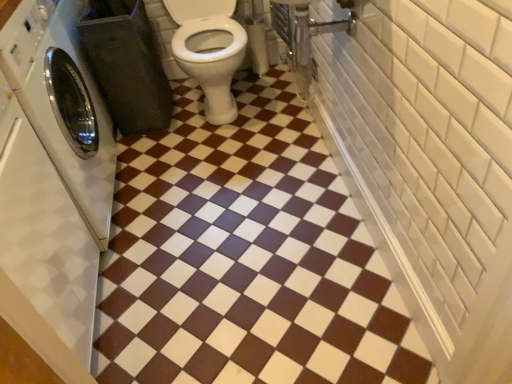
Image resolution: width=512 pixels, height=384 pixels. What do you see at coordinates (245, 257) in the screenshot?
I see `brown glossy tile at center` at bounding box center [245, 257].

This screenshot has width=512, height=384. Identify the location of brown glossy tile at center. coord(245,257).

Describe the element at coordinates (63, 104) in the screenshot. I see `white glossy washing machine at left` at that location.

Measure the distance between point (70, 140) and camera.

1.42 meters.

Locate an element on the screen. white glossy washing machine at left is located at coordinates (63, 104).

Image resolution: width=512 pixels, height=384 pixels. Find the location of `brown glossy tile at center`. brown glossy tile at center is located at coordinates (245, 257).

Considering the positions of objects white glossy washing machine at left and brown glossy tile at center in the image provided, who is more to the right, white glossy washing machine at left or brown glossy tile at center?

Positioned to the right is brown glossy tile at center.

Between white glossy washing machine at left and brown glossy tile at center, which one is positioned behind?

brown glossy tile at center is further from the camera.

Does point (19, 76) appear closer or farther from the camera than point (269, 266)?

Point (19, 76) is positioned closer to the camera compared to point (269, 266).

From the image's perspective, which one is positioned higher, white glossy washing machine at left or brown glossy tile at center?

white glossy washing machine at left appears higher in the image.

From a real-world perspective, which is physically below, white glossy washing machine at left or brown glossy tile at center?

brown glossy tile at center, from a real-world perspective.

Looking at this image, can you confirm if white glossy washing machine at left is wider than brown glossy tile at center?

No.

Can you confirm if white glossy washing machine at left is taller than brown glossy tile at center?

Correct, white glossy washing machine at left is much taller as brown glossy tile at center.

Between white glossy washing machine at left and brown glossy tile at center, which one has larger size?

white glossy washing machine at left.

Does white glossy washing machine at left contain brown glossy tile at center?

Actually, brown glossy tile at center is outside white glossy washing machine at left.

Are white glossy washing machine at left and brown glossy tile at center making contact?

No, white glossy washing machine at left is not next to brown glossy tile at center.

Is white glossy washing machine at left oriented away from brown glossy tile at center?

No, white glossy washing machine at left is not facing away from brown glossy tile at center.

Can you tell me how much white glossy washing machine at left and brown glossy tile at center differ in facing direction?

white glossy washing machine at left and brown glossy tile at center are facing 90.4 degrees away from each other.

Locate an element on the screen. This screenshot has width=512, height=384. ceramic tile below the white glossy washing machine at left (from the image's perspective) is located at coordinates (245, 257).

Is brown glossy tile at center at the left side of white glossy washing machine at left?

Incorrect, brown glossy tile at center is not on the left side of white glossy washing machine at left.

Does brown glossy tile at center lie in front of white glossy washing machine at left?

No, brown glossy tile at center is further to the viewer.

Considering the points (221, 355) and (29, 31), which point is in front, point (221, 355) or point (29, 31)?

Positioned in front is point (29, 31).

From the image's perspective, is brown glossy tile at center located above white glossy washing machine at left?

Actually, brown glossy tile at center appears below white glossy washing machine at left in the image.

From a real-world perspective, is brown glossy tile at center beneath white glossy washing machine at left?

Yes, from a real-world perspective, brown glossy tile at center is under white glossy washing machine at left.

Between brown glossy tile at center and white glossy washing machine at left, which one has smaller width?

Thinner between the two is white glossy washing machine at left.

Can you confirm if brown glossy tile at center is taller than white glossy washing machine at left?

In fact, brown glossy tile at center may be shorter than white glossy washing machine at left.

Which of these two, brown glossy tile at center or white glossy washing machine at left, is smaller?

brown glossy tile at center is smaller.

Is brown glossy tile at center located outside white glossy washing machine at left?

Indeed, brown glossy tile at center is completely outside white glossy washing machine at left.

Would you say brown glossy tile at center is a long distance from white glossy washing machine at left?

Actually, brown glossy tile at center and white glossy washing machine at left are a little close together.

Is brown glossy tile at center facing towards white glossy washing machine at left?

No, brown glossy tile at center is not turned towards white glossy washing machine at left.

Based on the photo, how many degrees apart are the facing directions of brown glossy tile at center and white glossy washing machine at left?

The angle between the facing direction of brown glossy tile at center and the facing direction of white glossy washing machine at left is 90.4 degrees.

Where is `ceramic tile below the white glossy washing machine at left (from the image's perspective)`? Image resolution: width=512 pixels, height=384 pixels. ceramic tile below the white glossy washing machine at left (from the image's perspective) is located at coordinates (245, 257).

Where is `washing machine above the brown glossy tile at center (from the image's perspective)`? washing machine above the brown glossy tile at center (from the image's perspective) is located at coordinates (63, 104).

Find the location of `washing machine on the left of brown glossy tile at center`. washing machine on the left of brown glossy tile at center is located at coordinates (63, 104).